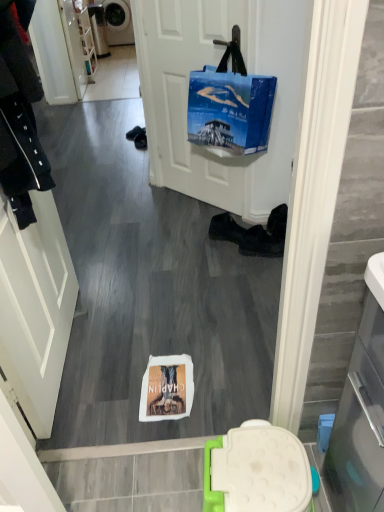
Identify the location of vacant area in front of black leather shoes at center, acting as the 2th footwear starting from the right. (218, 252).